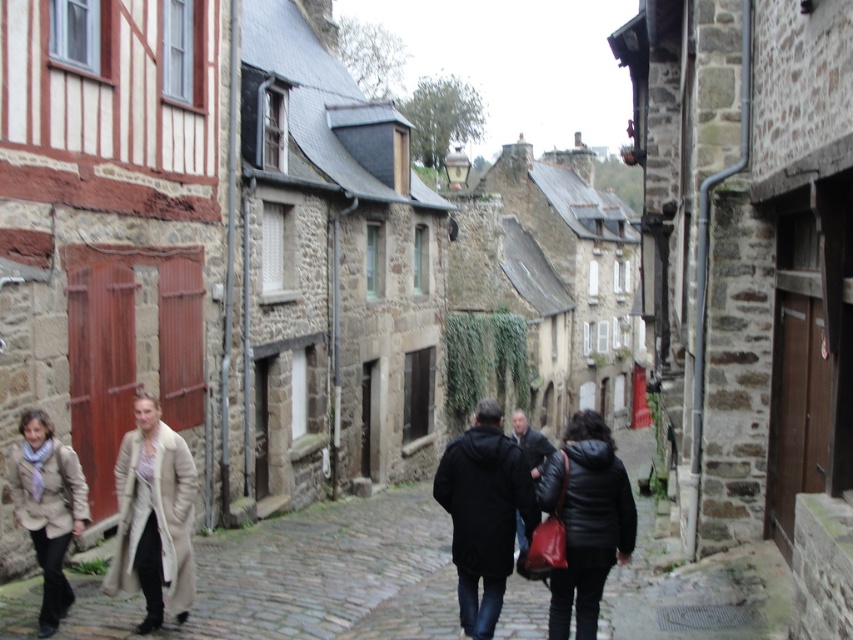
Question: Among these points, which one is nearest to the camera?

Choices:
 (A) (44, 604)
 (B) (508, 540)
 (C) (546, 508)

Answer: (C)

Question: Among these objects, which one is farthest from the camera?

Choices:
 (A) black leather jacket at center
 (B) beige wool coat at lower left
 (C) black matte coat at center
 (D) beige wool coat at center

Answer: (D)

Question: Can you confirm if beige wool coat at center is smaller than black leather jacket at center?

Choices:
 (A) no
 (B) yes

Answer: (B)

Question: Does black matte coat at center have a larger size compared to beige wool coat at center?

Choices:
 (A) no
 (B) yes

Answer: (B)

Question: Does black matte coat at center have a greater width compared to beige wool coat at center?

Choices:
 (A) yes
 (B) no

Answer: (A)

Question: Which object is the farthest from the black matte coat at center?

Choices:
 (A) beige wool coat at lower left
 (B) beige wool coat at center

Answer: (A)